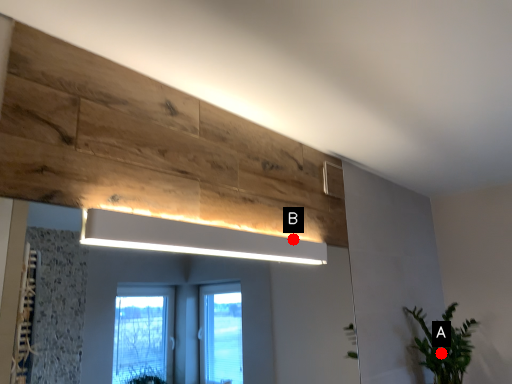
Question: Two points are circled on the image, labeled by A and B beside each circle. Among these points, which one is nearest to the camera?

Choices:
 (A) A is closer
 (B) B is closer

Answer: (B)